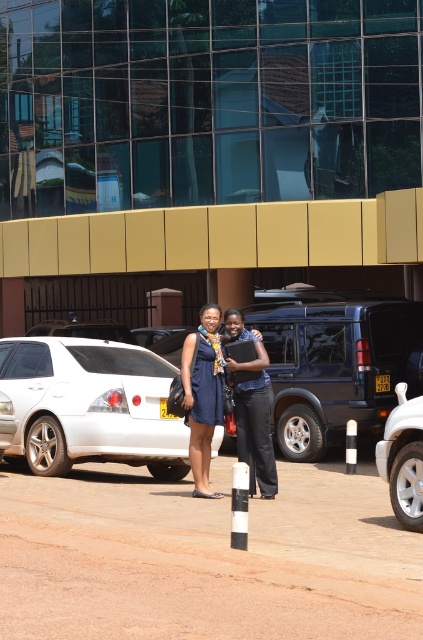
You are standing in front of the modern building and want to place a small decorative item at one of the two points marked on the ground. The first point is at coordinate point (315,576) and the second is at point (101,432). Which point is closer to you so that the item is more visible to visitors approaching the building?

Point (315,576) is closer to the viewer than point (101,432), so placing the item there would make it more visible to visitors approaching the building.

You are a photographer trying to capture the two people standing on the brown dirt track at center without the white glossy sedan at center appearing in the shot. Is it possible to do so by moving the camera position forward or backward along the track?

The brown dirt track at center is shorter than the white glossy sedan at center. Therefore, moving the camera position forward or backward along the track might not fully exclude the sedan from the frame since the sedan is longer and could still be visible depending on the angle and distance. However, adjusting the camera angle or zoom could help frame the people without the sedan.